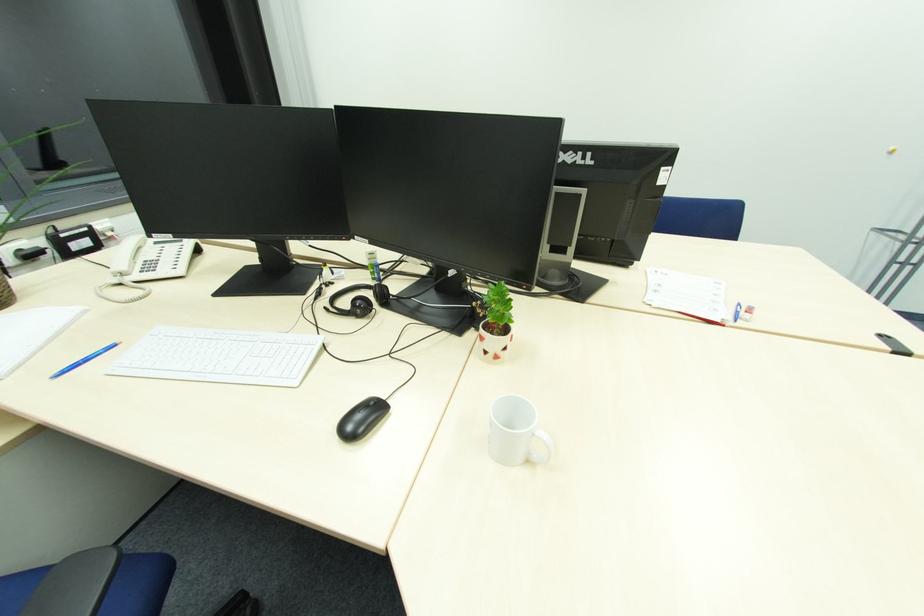
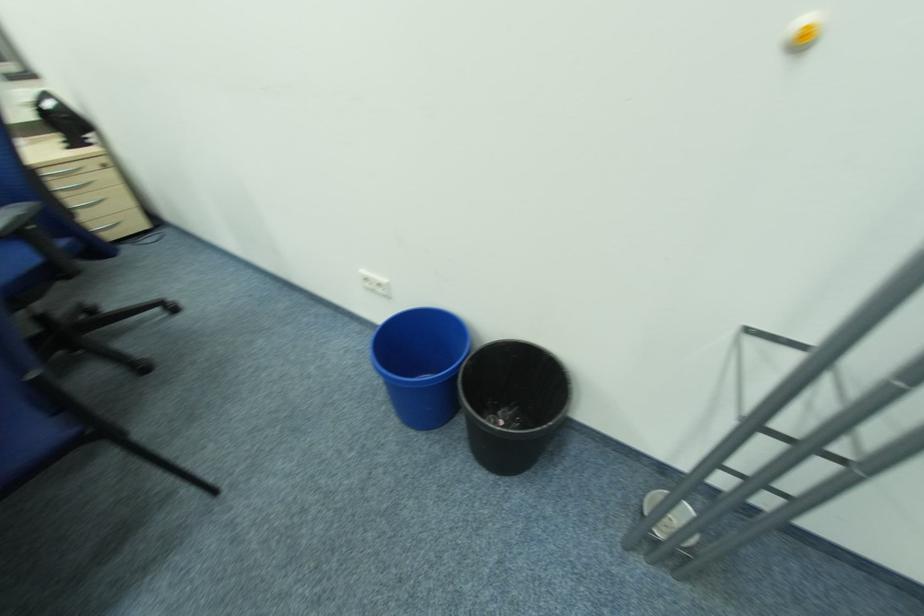
Which direction would the cameraman need to move to produce the second image?

The cameraman walked toward right, forward.